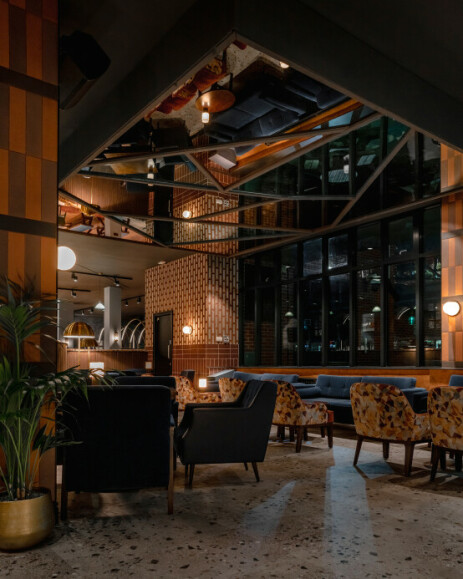
This screenshot has height=579, width=463. I want to click on mirror sections, so click(x=87, y=219), click(x=220, y=245), click(x=198, y=233), click(x=151, y=197), click(x=285, y=217), click(x=399, y=174), click(x=331, y=171), click(x=250, y=157), click(x=179, y=174), click(x=260, y=102).